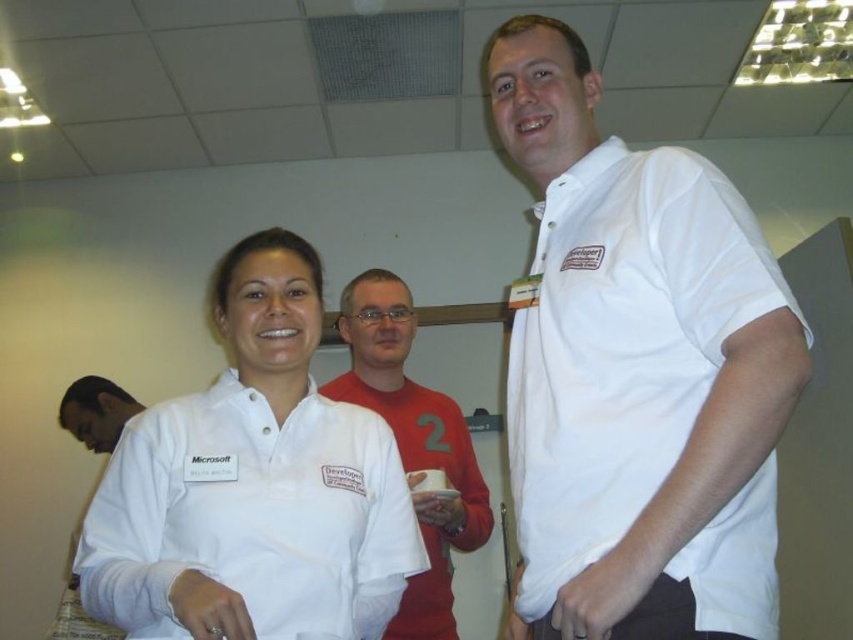
Which is above, white cotton shirt at center or dark skin smooth face at lower left?

white cotton shirt at center is higher up.

Which is behind, point (239, 609) or point (115, 420)?

The point (115, 420) is more distant.

Describe the element at coordinates (253, 484) in the screenshot. I see `white cotton shirt at center` at that location.

Identify the location of white cotton shirt at center. The image size is (853, 640). (253, 484).

Can you confirm if white cotton shirt at upper right is bigger than red matte shirt at center?

Incorrect, white cotton shirt at upper right is not larger than red matte shirt at center.

Is point (554, 480) farther from camera compared to point (404, 289)?

No, it is not.

Find the location of a particular element. white cotton shirt at upper right is located at coordinates (637, 372).

Who is positioned more to the right, white cotton shirt at upper right or white cotton shirt at center?

From the viewer's perspective, white cotton shirt at upper right appears more on the right side.

The height and width of the screenshot is (640, 853). I want to click on white cotton shirt at upper right, so click(637, 372).